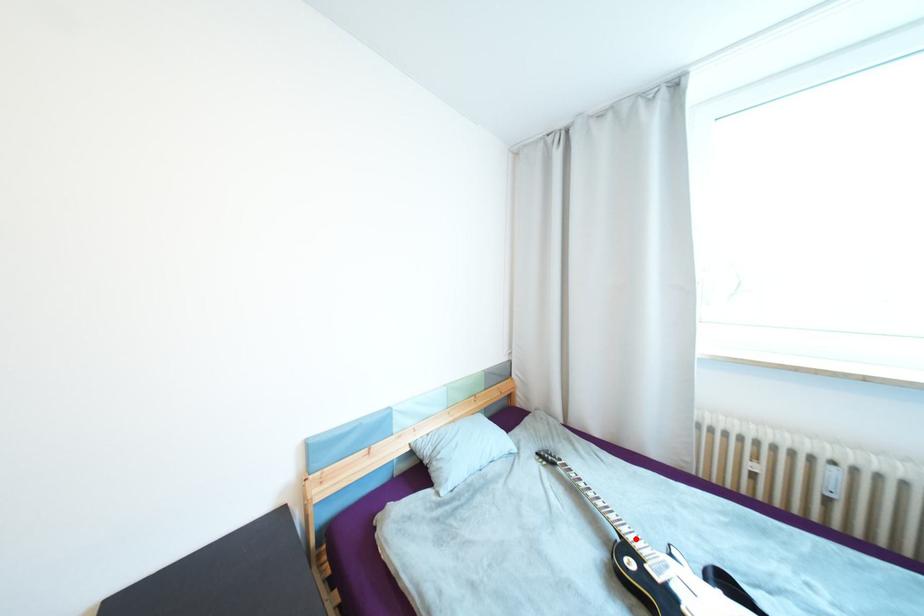
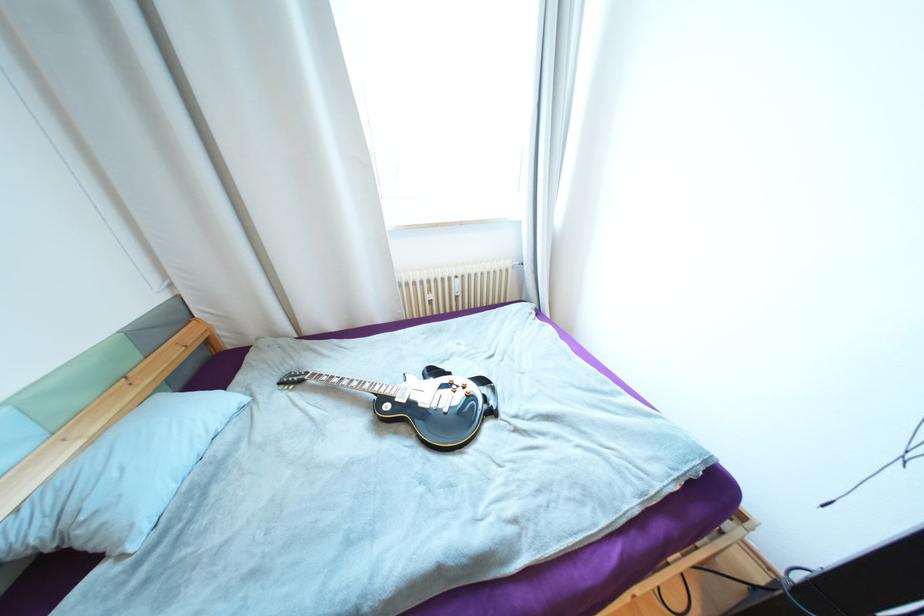
The point at the highlighted location is marked in the first image. Where is the corresponding point in the second image?

(387, 391)